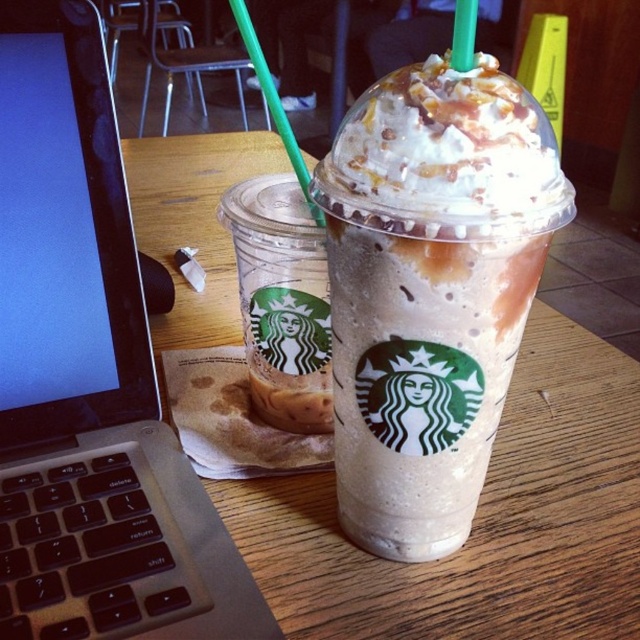
You are a customer at the Starbucks in the image. You want to place your phone on the wooden table at center without blocking the green plastic straw at upper center. Is the table high enough to allow this?

The wooden table at center has a greater height compared to green plastic straw at upper center, so placing your phone there should be possible without blocking the straw as the table is taller.

You have a black plastic laptop at left and a translucent plastic cup at left on the table. You want to slide the cup to the right to make space for your phone. Will the cup move past the laptop if you push it?

The black plastic laptop at left and translucent plastic cup at left are 3.51 inches apart from each other. Since the cup is to the left of the laptop and you want to slide it further to the right, it will move past the laptop as there is enough space between them.